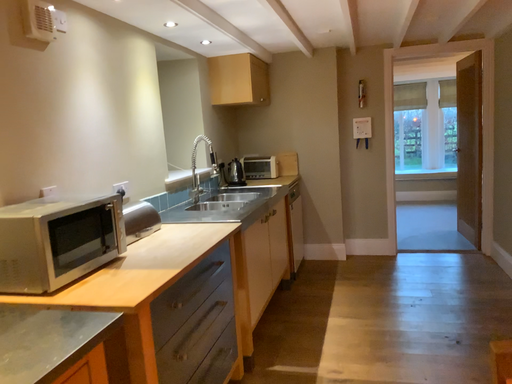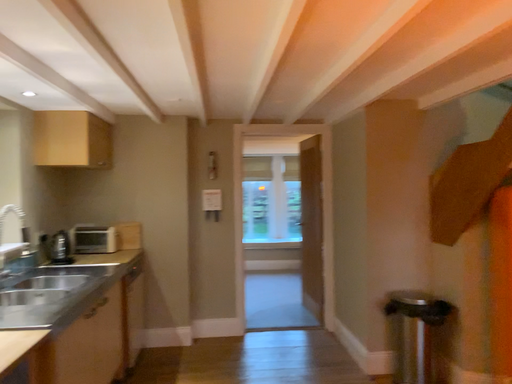
Question: Which way did the camera rotate in the video?

Choices:
 (A) rotated left
 (B) rotated right

Answer: (B)